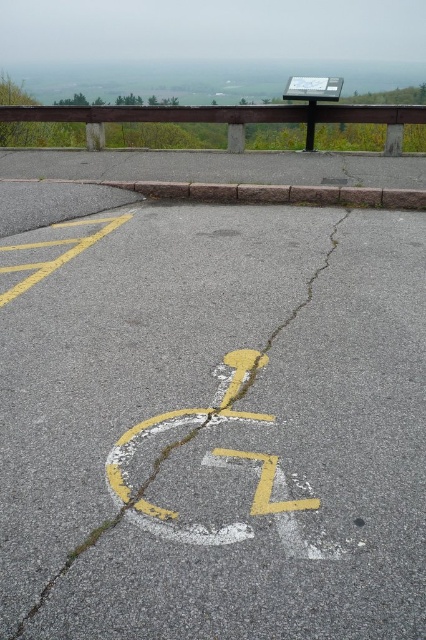
Which is below, yellow painted wheelchair symbol at center or white plastic sign at upper center?

yellow painted wheelchair symbol at center is below.

Is point (406, 384) farther from camera compared to point (298, 99)?

No, (406, 384) is in front of (298, 99).

Where is `yellow painted wheelchair symbol at center`? The width and height of the screenshot is (426, 640). yellow painted wheelchair symbol at center is located at coordinates (213, 424).

Who is positioned more to the left, yellow chalk circle at center or white plastic sign at upper center?

yellow chalk circle at center is more to the left.

Locate an element on the screen. yellow chalk circle at center is located at coordinates [155, 502].

Is yellow painted wheelchair symbol at center shorter than yellow chalk circle at center?

No.

Does yellow painted wheelchair symbol at center have a greater width compared to yellow chalk circle at center?

Yes, yellow painted wheelchair symbol at center is wider than yellow chalk circle at center.

Who is more forward, [78,282] or [261,420]?

Point [261,420]

Where is `yellow painted wheelchair symbol at center`? yellow painted wheelchair symbol at center is located at coordinates (213, 424).